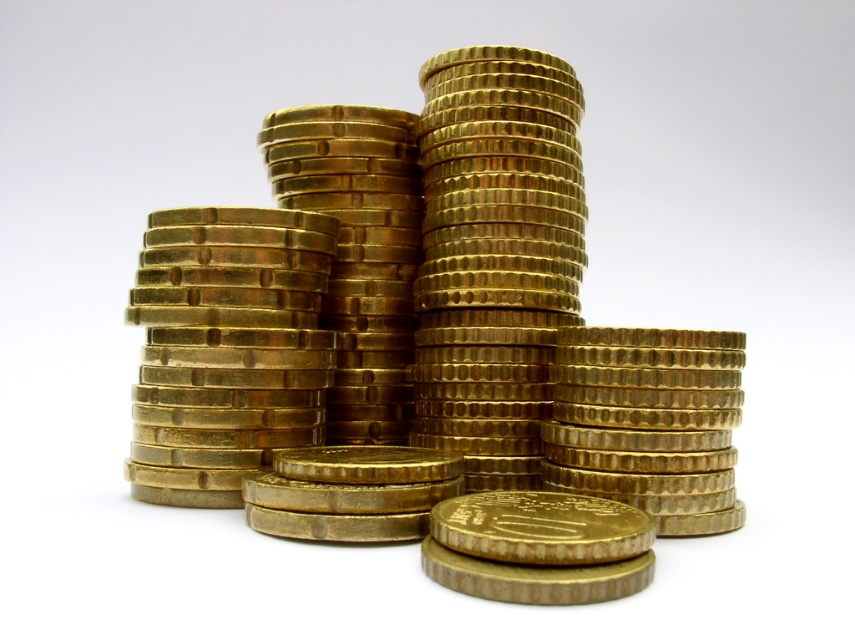
You are a treasure hunter who found a map marking a point at coordinates point (422, 339). According to the map, this point is where the treasure is buried. Looking at the image of the coins, where would you dig to find the treasure?

The treasure is buried at point (422, 339), which is on the gold shiny coins at center. So you should dig at the gold shiny coins at center.

You are a collector examining the image of coins. You notice two coin stacks labeled gold shiny coins at center and gold metallic coin at center. Which stack is positioned higher in the image?

The gold shiny coins at center is above the gold metallic coin at center, so the gold shiny coins at center stack is positioned higher in the image.